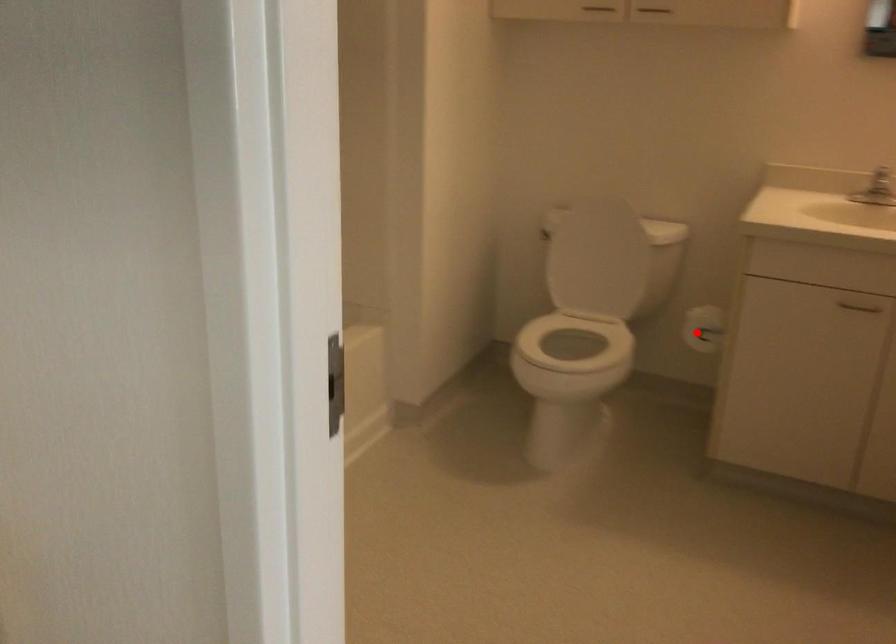
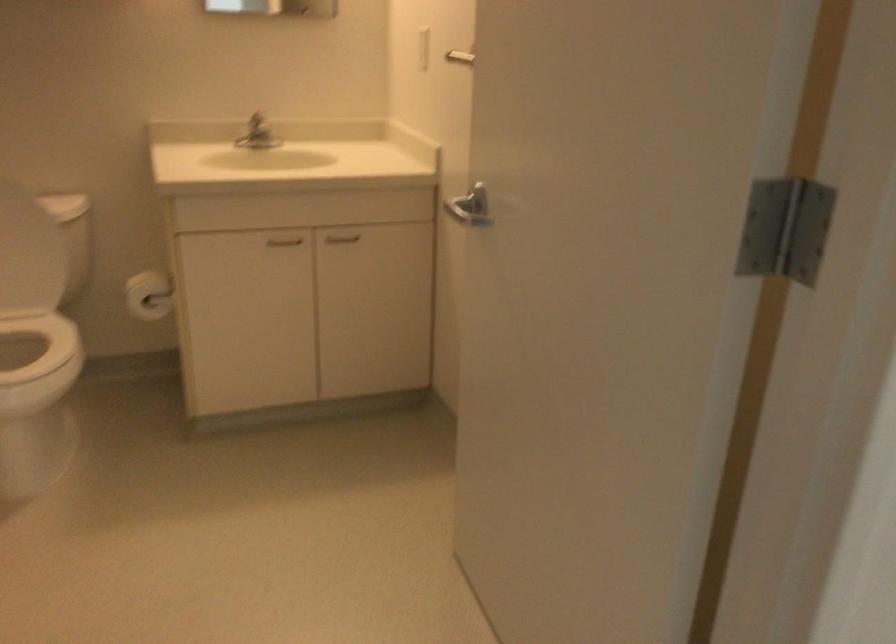
Where in the second image is the point corresponding to the highlighted location from the first image?

(149, 295)